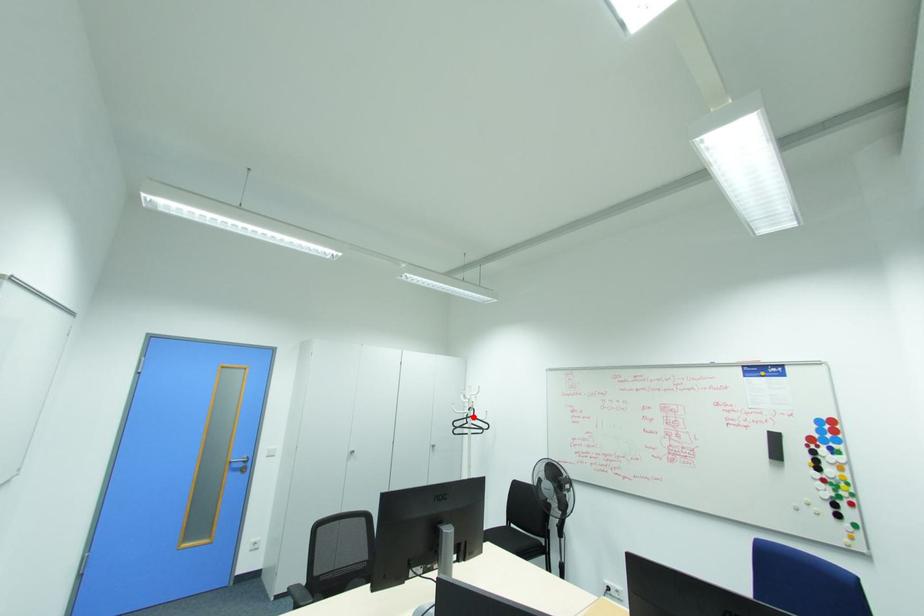
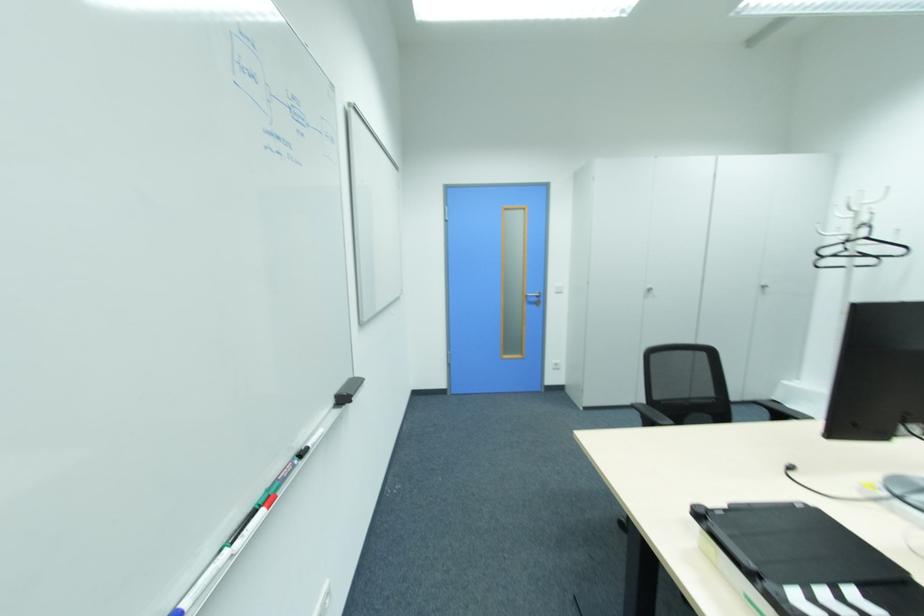
In the second image, find the point that corresponds to the highlighted location in the first image.

(865, 238)